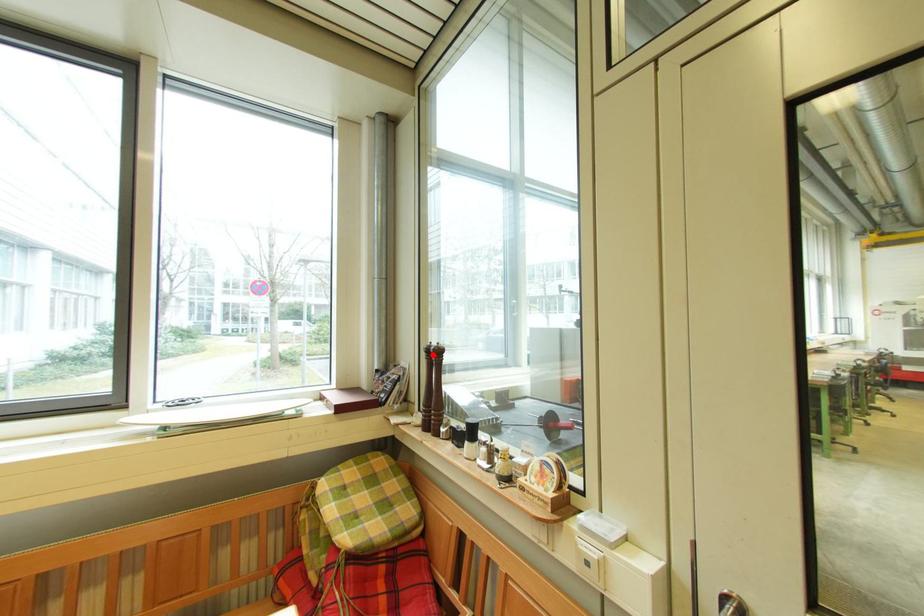
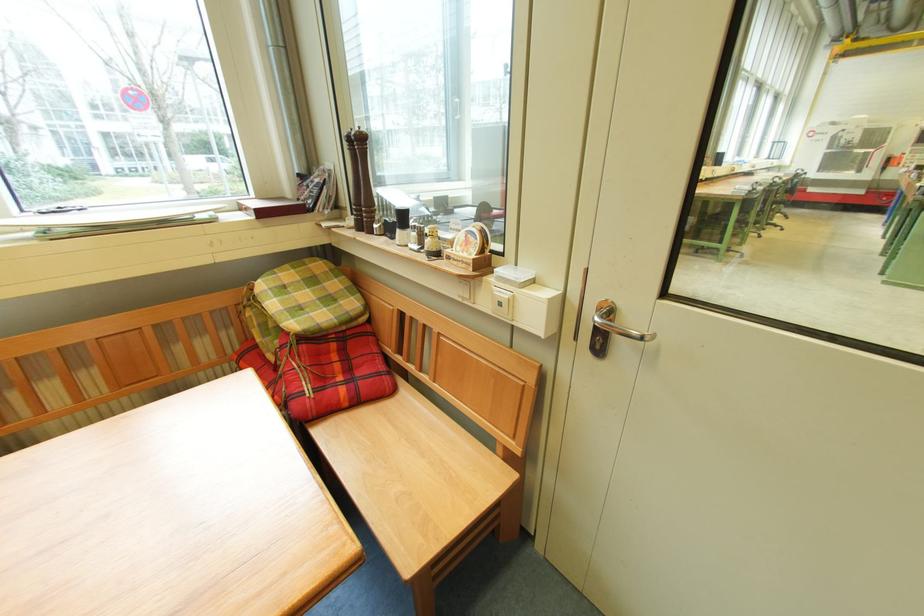
In the second image, find the point that corresponds to the highlighted location in the first image.

(354, 144)